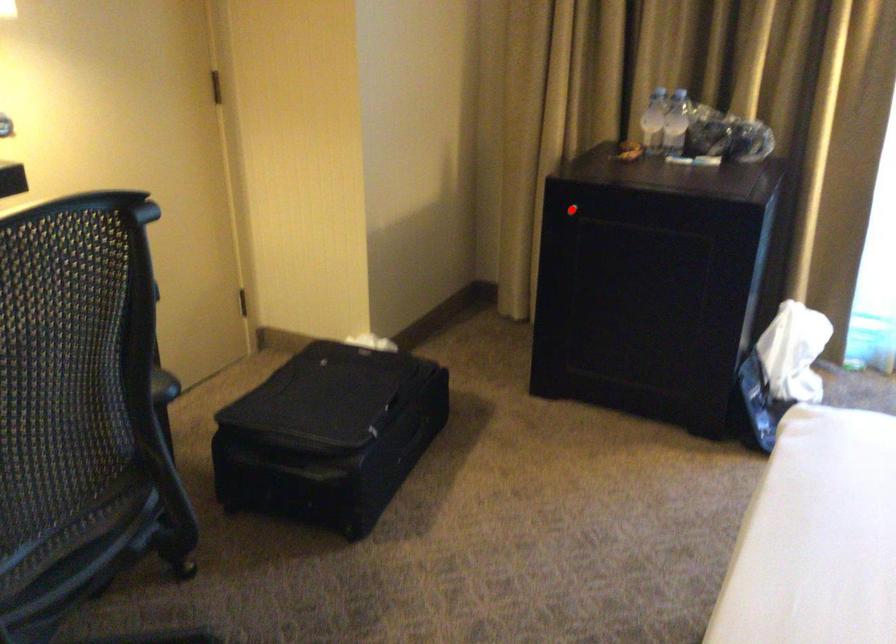
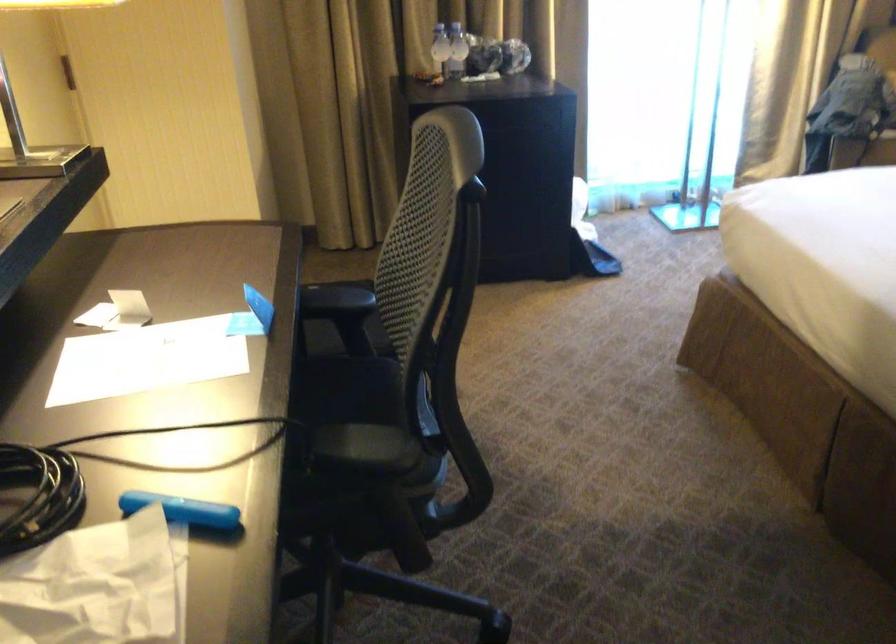
Question: I am providing you with two images of the same scene from different viewpoints. A red point is marked on the first image. Is the red point's position out of view in image 2?

Choices:
 (A) Yes
 (B) No

Answer: (A)